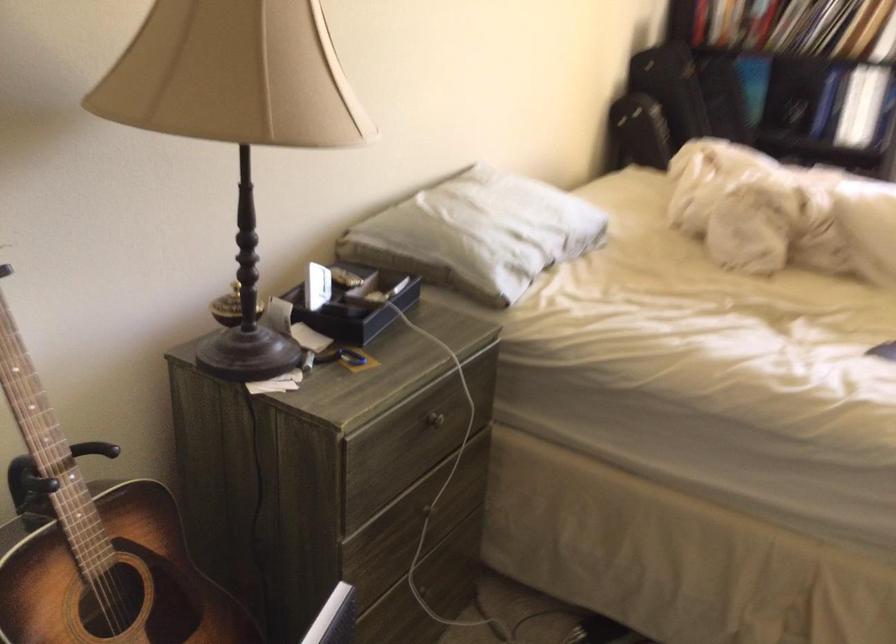
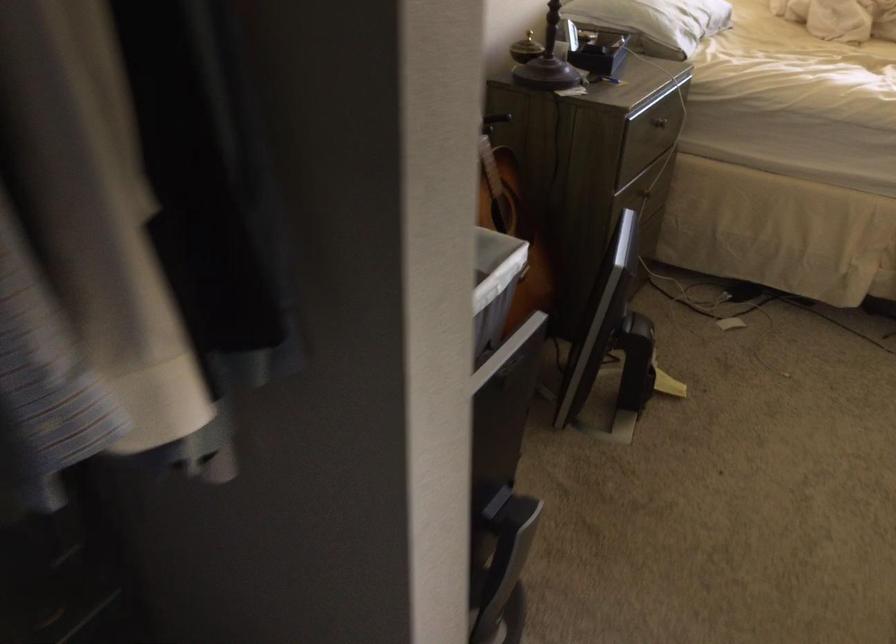
Locate, in the second image, the point that corresponds to (461,257) in the first image.

(655, 21)